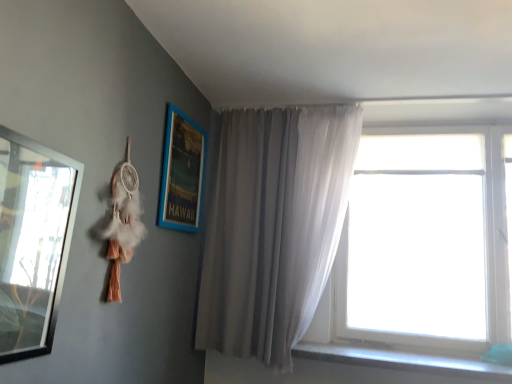
Question: Does gray fabric curtain at center have a smaller size compared to blue wooden picture frame at upper left, acting as the first picture frame starting from the back?

Choices:
 (A) yes
 (B) no

Answer: (B)

Question: Would you say gray fabric curtain at center contains blue wooden picture frame at upper left, the second picture frame viewed from the front?

Choices:
 (A) no
 (B) yes

Answer: (A)

Question: From a real-world perspective, is gray fabric curtain at center positioned over blue wooden picture frame at upper left, the second picture frame viewed from the front, based on gravity?

Choices:
 (A) yes
 (B) no

Answer: (B)

Question: Could you tell me if gray fabric curtain at center is turned towards blue wooden picture frame at upper left, which is the first picture frame from right to left?

Choices:
 (A) yes
 (B) no

Answer: (A)

Question: Is gray fabric curtain at center bigger than blue wooden picture frame at upper left, the second picture frame viewed from the front?

Choices:
 (A) no
 (B) yes

Answer: (B)

Question: From a real-world perspective, is gray concrete window sill at lower right physically located above or below gray fabric curtain at center?

Choices:
 (A) below
 (B) above

Answer: (A)

Question: In terms of size, does gray concrete window sill at lower right appear bigger or smaller than gray fabric curtain at center?

Choices:
 (A) big
 (B) small

Answer: (B)

Question: In the image, is gray concrete window sill at lower right positioned in front of or behind gray fabric curtain at center?

Choices:
 (A) behind
 (B) front

Answer: (B)

Question: Considering the positions of point (411, 352) and point (268, 142), is point (411, 352) closer or farther from the camera than point (268, 142)?

Choices:
 (A) closer
 (B) farther

Answer: (A)

Question: Considering their positions, is blue wooden picture frame at upper left, which is the first picture frame from right to left, located in front of or behind gray fabric curtain at center?

Choices:
 (A) front
 (B) behind

Answer: (A)

Question: In terms of width, does blue wooden picture frame at upper left, the second picture frame viewed from the front, look wider or thinner when compared to gray fabric curtain at center?

Choices:
 (A) thin
 (B) wide

Answer: (A)

Question: Looking at the image, does blue wooden picture frame at upper left, acting as the first picture frame starting from the back, seem bigger or smaller compared to gray fabric curtain at center?

Choices:
 (A) small
 (B) big

Answer: (A)

Question: From the image's perspective, is blue wooden picture frame at upper left, which is the second picture frame in left-to-right order, positioned above or below gray fabric curtain at center?

Choices:
 (A) below
 (B) above

Answer: (B)

Question: From their relative heights in the image, would you say metallic silver mirror at left, positioned as the second picture frame in right-to-left order, is taller or shorter than blue wooden picture frame at upper left, which is the second picture frame in left-to-right order?

Choices:
 (A) short
 (B) tall

Answer: (A)

Question: From the image's perspective, is metallic silver mirror at left, positioned as the second picture frame in right-to-left order, positioned above or below blue wooden picture frame at upper left, the second picture frame viewed from the front?

Choices:
 (A) above
 (B) below

Answer: (B)